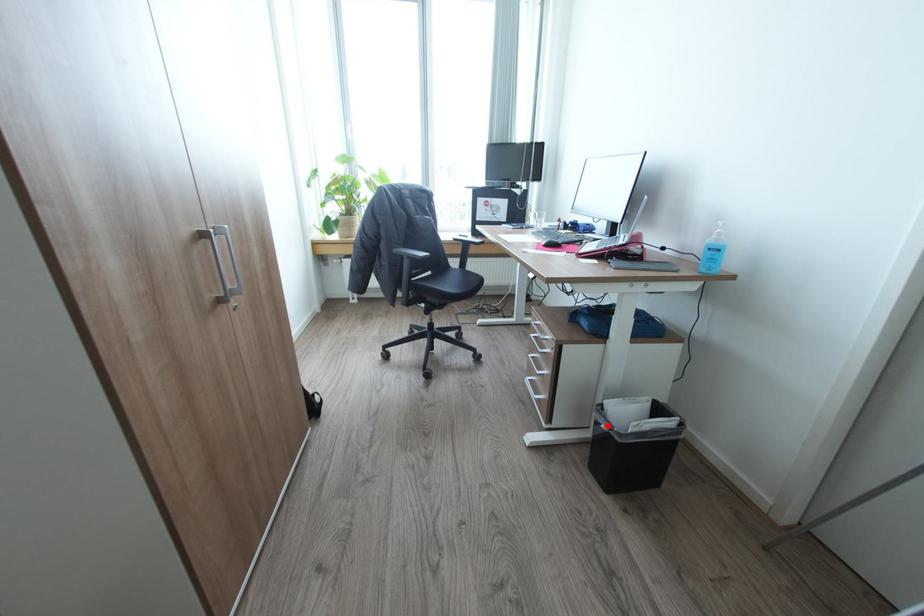
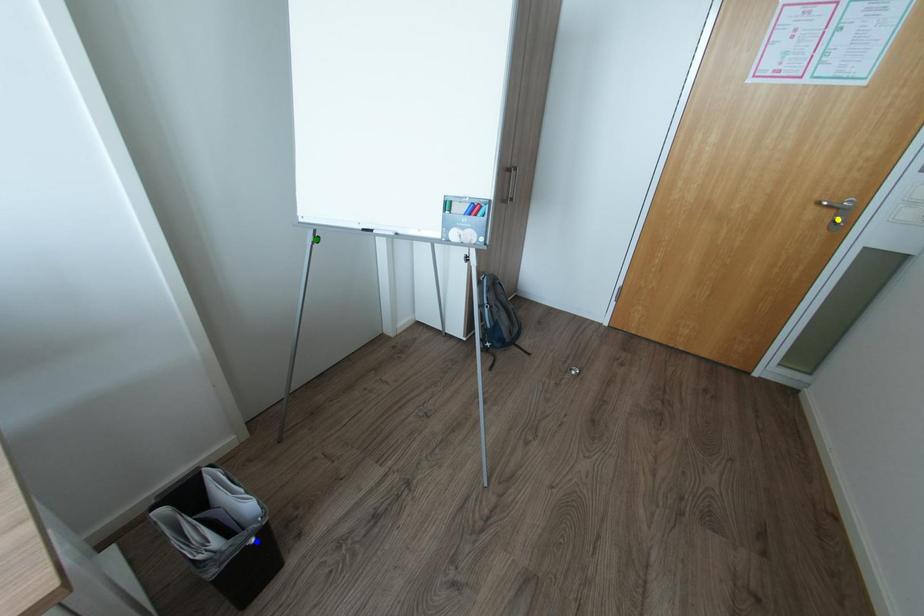
Question: I am providing you with two images of the same scene from different viewpoints. A red point is marked on the first image. You are given multiple points on the second image. Which spot in image 2 lines up with the point in image 1?

Choices:
 (A) yellow point
 (B) blue point
 (C) green point

Answer: (B)